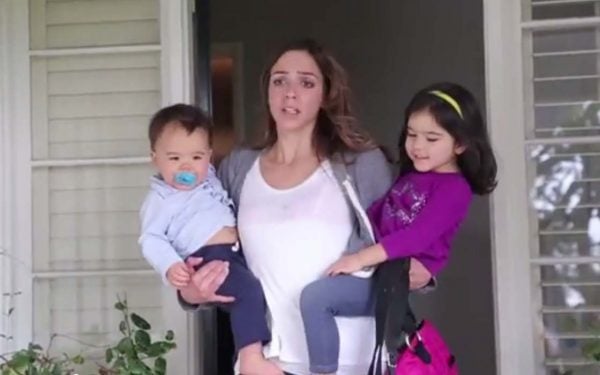
Where is `doorway`? The width and height of the screenshot is (600, 375). doorway is located at coordinates coord(261,12).